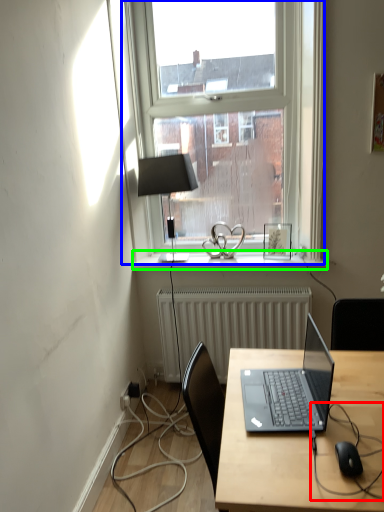
Question: Estimate the real-world distances between objects in this image. Which object is farther from cable (highlighted by a red box), window (highlighted by a blue box) or window sill (highlighted by a green box)?

Choices:
 (A) window
 (B) window sill

Answer: (A)